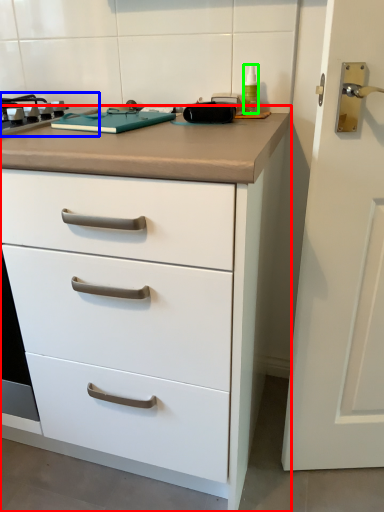
Question: Considering the real-world distances, which object is closest to chest of drawers (highlighted by a red box)? gas stove (highlighted by a blue box) or bottle (highlighted by a green box).

Choices:
 (A) gas stove
 (B) bottle

Answer: (A)